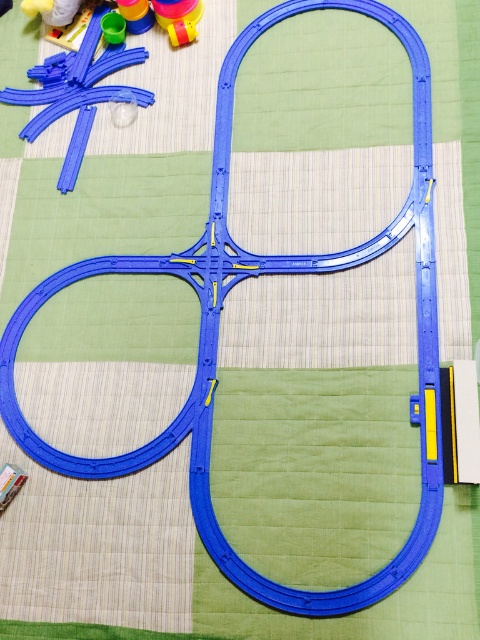
Who is lower down, rubber yellow toy at upper center or translucent yellow cup at upper left?

rubber yellow toy at upper center

Can you confirm if rubber yellow toy at upper center is thinner than translucent yellow cup at upper left?

Answer: In fact, rubber yellow toy at upper center might be wider than translucent yellow cup at upper left.

Find the location of a particular element. rubber yellow toy at upper center is located at coordinates (179, 19).

Is matte plastic track at upper left below rubberized yellow cup at upper left?

Yes.

Is point (35, 116) closer to viewer compared to point (56, 12)?

Yes, point (35, 116) is closer to viewer.

Between point (72, 72) and point (46, 0), which one is positioned in front?

Point (72, 72) is in front.

Where is `matte plastic track at upper left`? This screenshot has height=640, width=480. matte plastic track at upper left is located at coordinates (76, 92).

Between matte plastic track at upper left and rubber yellow toy at upper center, which one has more height?

With more height is matte plastic track at upper left.

Who is higher up, matte plastic track at upper left or rubber yellow toy at upper center?

rubber yellow toy at upper center is higher up.

Find the location of `matte plastic track at upper left`. matte plastic track at upper left is located at coordinates [x=76, y=92].